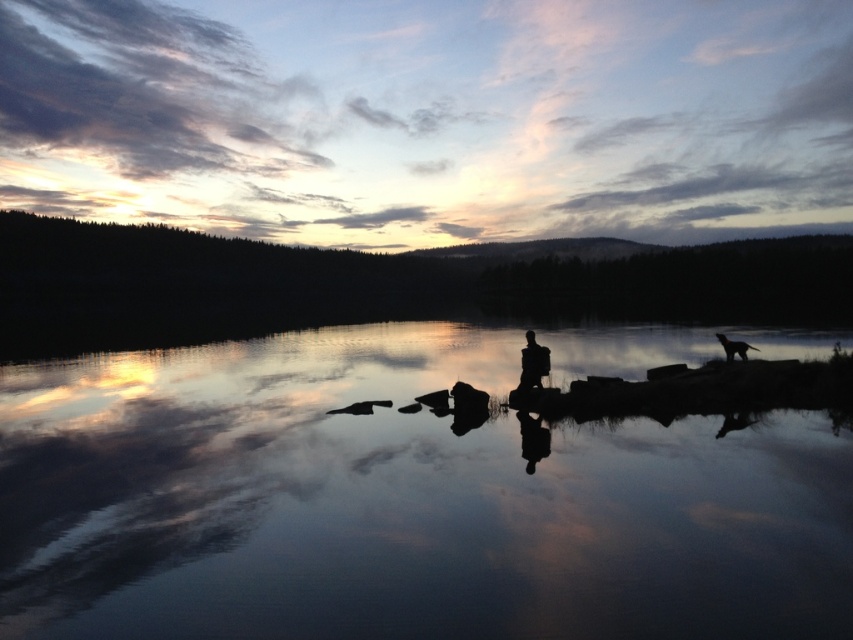
You are standing at the lakeside and want to take a photo of both the smooth reflective water at center and the silhouette figure at right. Since you want to capture the reflection clearly, which object should you focus on first, the one that is taller or the one that is shorter?

The smooth reflective water at center has a greater height compared to the silhouette figure at right. Therefore, you should focus on the smooth reflective water at center first because it is taller and will ensure the reflection is captured clearly.

You are an artist planning to paint this lakeside scene. You want to ensure the silhouette figure at right is proportionally smaller than the smooth reflective water at center. Does the current arrangement allow this?

Yes, the smooth reflective water at center is bigger than the silhouette figure at right, so the current arrangement allows the silhouette figure at right to be proportionally smaller.

You are an artist trying to sketch this lakeside scene. You need to ensure that the smooth reflective water at center and the silhouette figure at center are proportionally accurate. Which object should you draw first to maintain the correct size relationship between them?

You should draw the smooth reflective water at center first since it is larger than the silhouette figure at center, ensuring the size relationship is maintained.